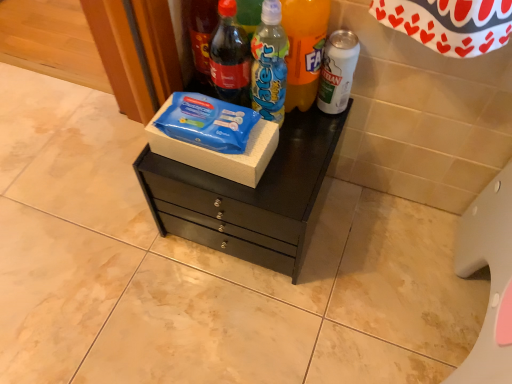
The width and height of the screenshot is (512, 384). I want to click on free space to the right of blue plastic lunch box at center, so click(298, 164).